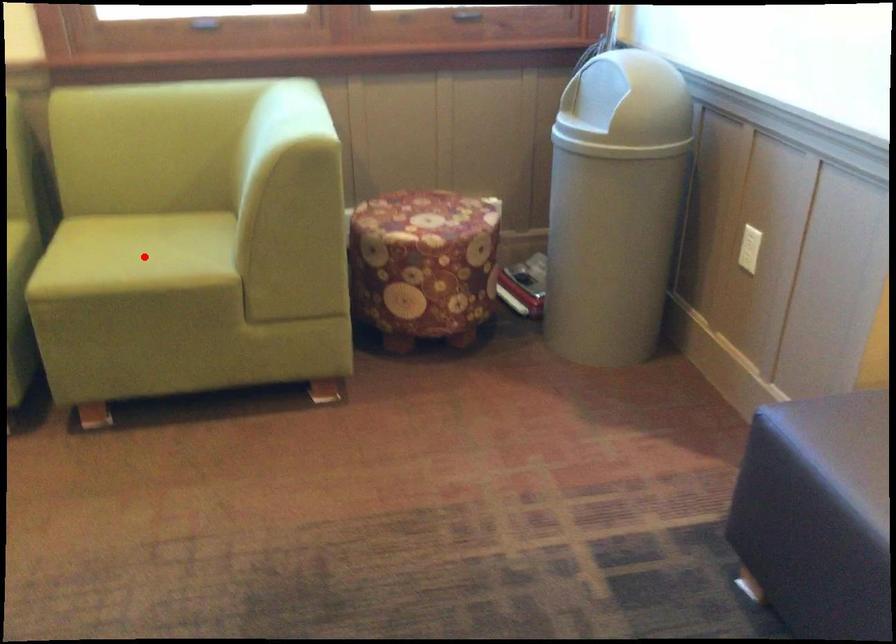
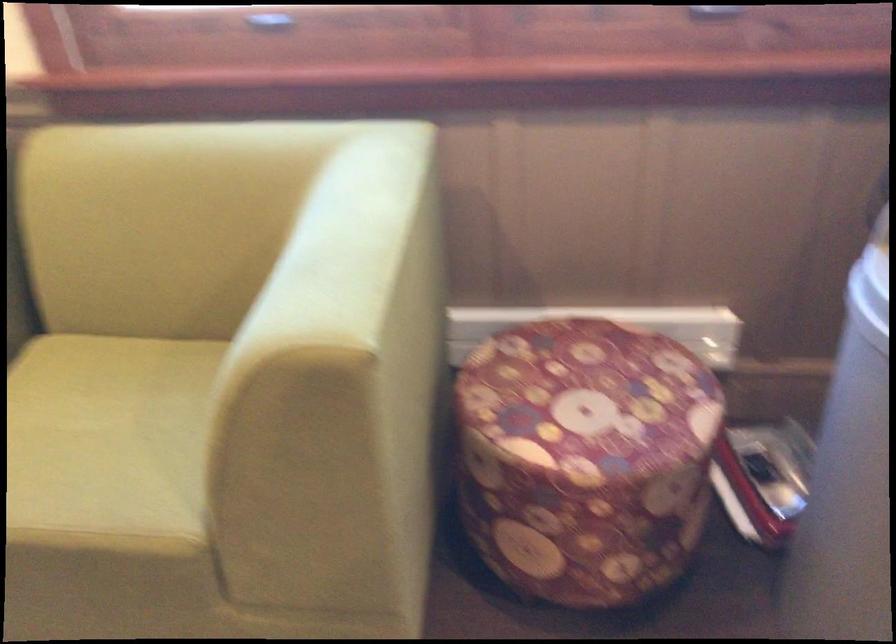
Question: I am providing you with two images of the same scene from different viewpoints. Image1 has a red point marked. In image2, the corresponding 3D location appears at what relative position? Reply with the corresponding letter.

Choices:
 (A) Closer
 (B) Farther

Answer: (A)